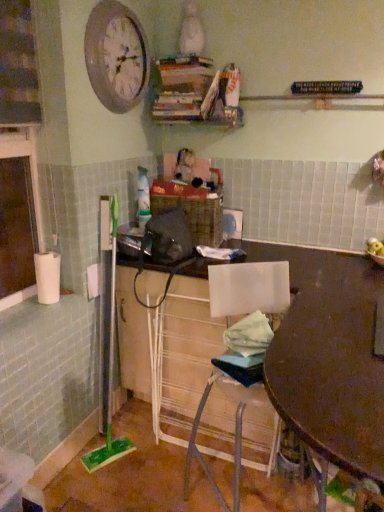
Question: Does wooden clock at upper left have a greater width compared to wooden table at center?

Choices:
 (A) yes
 (B) no

Answer: (B)

Question: Is wooden clock at upper left thinner than wooden table at center?

Choices:
 (A) no
 (B) yes

Answer: (B)

Question: From a real-world perspective, is wooden clock at upper left physically below wooden table at center?

Choices:
 (A) yes
 (B) no

Answer: (B)

Question: From the image's perspective, would you say wooden clock at upper left is positioned over wooden table at center?

Choices:
 (A) no
 (B) yes

Answer: (B)

Question: Can you confirm if wooden clock at upper left is bigger than wooden table at center?

Choices:
 (A) yes
 (B) no

Answer: (B)

Question: Looking at their shapes, would you say matte brown desk at center is wider or thinner than wooden table at center?

Choices:
 (A) thin
 (B) wide

Answer: (A)

Question: Is matte brown desk at center to the left or to the right of wooden table at center in the image?

Choices:
 (A) left
 (B) right

Answer: (A)

Question: From the image's perspective, is matte brown desk at center located above or below wooden table at center?

Choices:
 (A) above
 (B) below

Answer: (A)

Question: Is point 144,285 positioned closer to the camera than point 322,437?

Choices:
 (A) farther
 (B) closer

Answer: (A)

Question: In the image, is matte brown desk at center positioned in front of or behind white plastic chair at lower center?

Choices:
 (A) behind
 (B) front

Answer: (B)

Question: Is matte brown desk at center bigger or smaller than white plastic chair at lower center?

Choices:
 (A) big
 (B) small

Answer: (A)

Question: From the image's perspective, is matte brown desk at center positioned above or below white plastic chair at lower center?

Choices:
 (A) below
 (B) above

Answer: (B)

Question: Choose the correct answer: Is matte brown desk at center inside white plastic chair at lower center or outside it?

Choices:
 (A) outside
 (B) inside

Answer: (A)

Question: Visually, is wooden table at center positioned to the left or to the right of white plastic chair at lower center?

Choices:
 (A) right
 (B) left

Answer: (A)

Question: Considering the positions of wooden table at center and white plastic chair at lower center in the image, is wooden table at center wider or thinner than white plastic chair at lower center?

Choices:
 (A) thin
 (B) wide

Answer: (B)